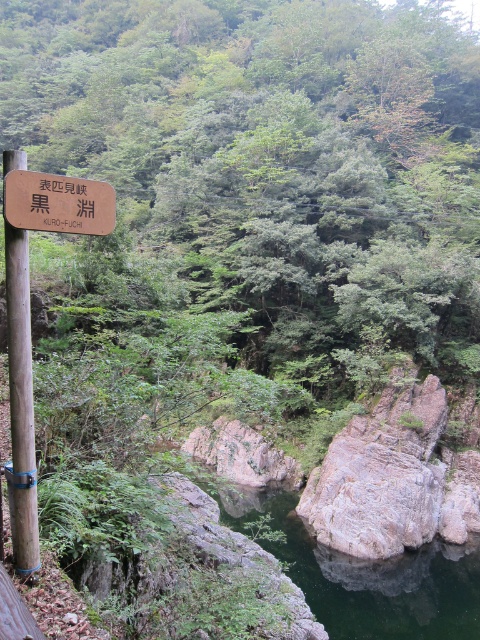
You are standing at the wooden signpost in the foreground and want to reach the point labeled as point (15, 476). Is the point (295, 497) closer to you or further away than the destination point?

Point (295, 497) is further to the viewer than point (15, 476), so the point (295, 497) is further away from you than the destination point (15, 476).

You are a hiker who wants to take a photo of the brown wooden sign at upper left. You notice the brown wooden pole at left is blocking part of the sign. Which object is narrower so you can move it to get a clear shot?

The brown wooden pole at left has a lesser width compared to the brown wooden sign at upper left, so you can move the brown wooden pole at left to get a clear shot.